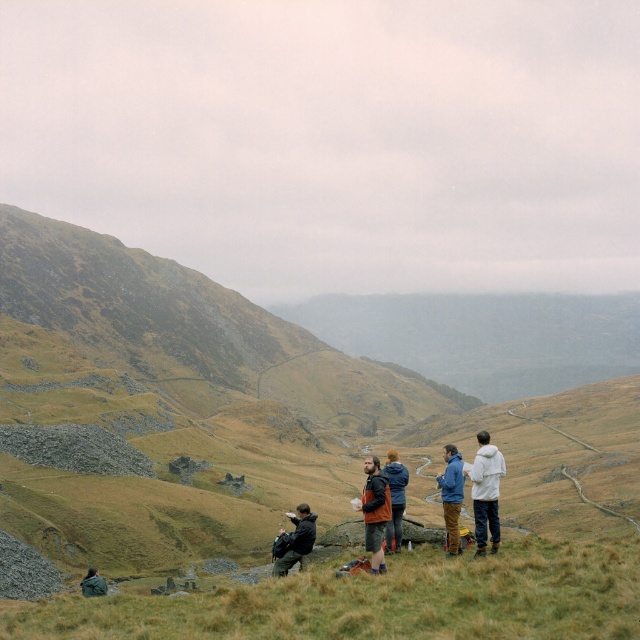
Question: Can you confirm if green grassy at lower center is bigger than dark gray jacket at center?

Choices:
 (A) no
 (B) yes

Answer: (B)

Question: Estimate the real-world distances between objects in this image. Which object is closer to the blue denim jacket at center?

Choices:
 (A) blue jacket at center
 (B) green grassy at lower center
 (C) white fleece jacket at right

Answer: (C)

Question: Can you confirm if dark brown leather jacket at center is thinner than blue denim jacket at center?

Choices:
 (A) no
 (B) yes

Answer: (B)

Question: Which point is closer to the camera taking this photo?

Choices:
 (A) (387, 477)
 (B) (314, 534)
 (C) (451, 449)
 (D) (376, 486)

Answer: (D)

Question: Among these objects, which one is farthest from the camera?

Choices:
 (A) dark gray jacket at center
 (B) green fabric jacket at lower left
 (C) green grassy at lower center

Answer: (B)

Question: Is dark brown leather jacket at center to the left of blue jacket at center from the viewer's perspective?

Choices:
 (A) no
 (B) yes

Answer: (B)